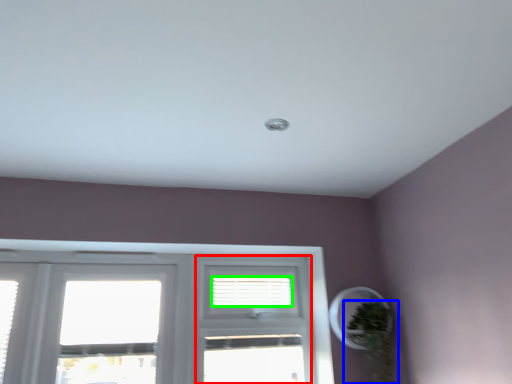
Question: Based on their relative distances, which object is nearer to screen door (highlighted by a red box)? Choose from houseplant (highlighted by a blue box) and blind (highlighted by a green box).

Choices:
 (A) houseplant
 (B) blind

Answer: (B)